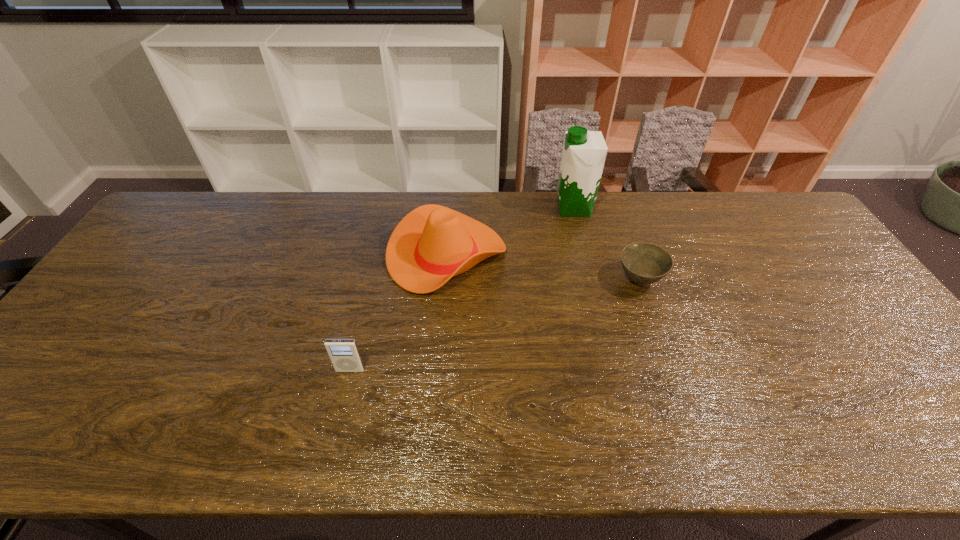
The width and height of the screenshot is (960, 540). In order to click on free space between the second tallest object and the second object from right to left in this screenshot , I will do `click(510, 232)`.

I want to click on unoccupied area between the second shortest object and the third shortest object, so click(398, 313).

Identify the location of free spot between the shortest object and the cowboy hat. (542, 267).

Find the location of a particular element. vacant area that lies between the iPod and the soya milk is located at coordinates (462, 289).

At what (x,y) coordinates should I click in order to perform the action: click on empty space between the third object from left to right and the cowboy hat. Please return your answer as a coordinate pair (x, y). The width and height of the screenshot is (960, 540). Looking at the image, I should click on (510, 232).

Find the location of a particular element. The width and height of the screenshot is (960, 540). vacant region between the rightmost object and the soya milk is located at coordinates (607, 244).

The height and width of the screenshot is (540, 960). Find the location of `free space between the iPod and the tallest object`. free space between the iPod and the tallest object is located at coordinates (462, 289).

What are the coordinates of `free space between the tallest object and the bowl` in the screenshot? It's located at (607, 244).

You are a GUI agent. You are given a task and a screenshot of the screen. Output one action in this format:
    pyautogui.click(x=<x>, y=<y>)
    Task: Click on the vacant space in between the third tallest object and the cowboy hat
    This screenshot has height=540, width=960.
    Given the screenshot: What is the action you would take?
    pyautogui.click(x=398, y=313)

Where is `object that is the nearest to the third tallest object`? This screenshot has height=540, width=960. object that is the nearest to the third tallest object is located at coordinates (431, 244).